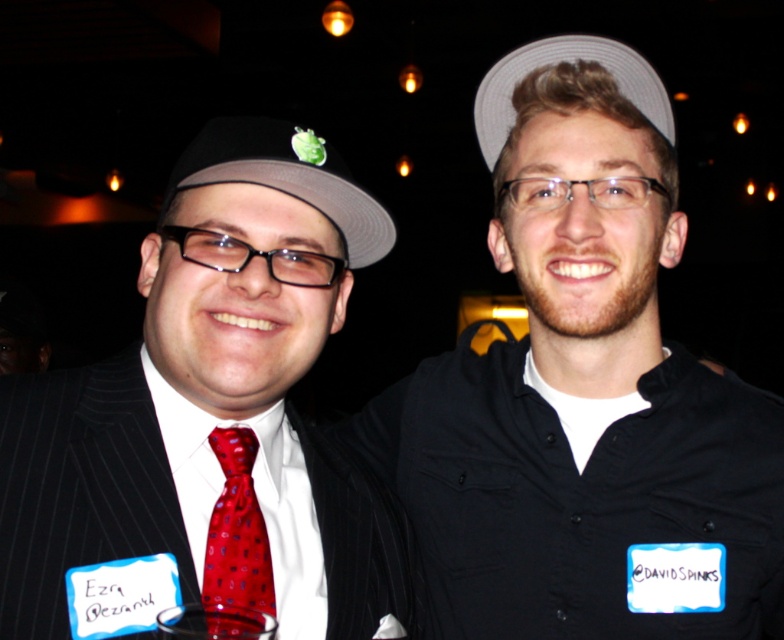
Does black matte shirt at center have a larger size compared to shiny red tie at center?

Yes, black matte shirt at center is bigger than shiny red tie at center.

Describe the element at coordinates (583, 394) in the screenshot. I see `black matte shirt at center` at that location.

The image size is (784, 640). Find the location of `black matte shirt at center`. black matte shirt at center is located at coordinates (583, 394).

Does point (209, 604) come behind point (234, 627)?

No.

Is shiny red tie at center to the left of transparent plastic wine glass at center from the viewer's perspective?

Yes, shiny red tie at center is to the left of transparent plastic wine glass at center.

The image size is (784, 640). What are the coordinates of `shiny red tie at center` in the screenshot? It's located at (236, 544).

Can you confirm if black matte shirt at center is smaller than brown fabric baseball hat at upper center?

Actually, black matte shirt at center might be larger than brown fabric baseball hat at upper center.

Can you confirm if black matte shirt at center is thinner than brown fabric baseball hat at upper center?

In fact, black matte shirt at center might be wider than brown fabric baseball hat at upper center.

The image size is (784, 640). I want to click on black matte shirt at center, so click(x=583, y=394).